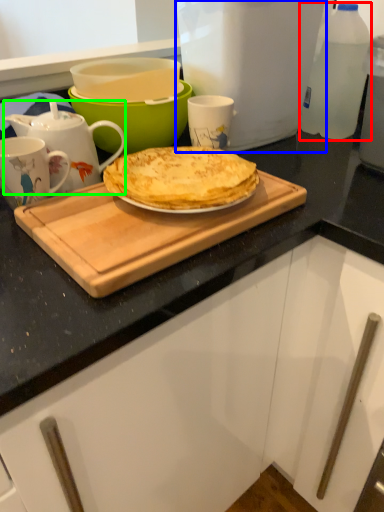
Question: Which is nearer to the bottle (highlighted by a red box)? kitchen appliance (highlighted by a blue box) or teapot (highlighted by a green box).

Choices:
 (A) kitchen appliance
 (B) teapot

Answer: (A)